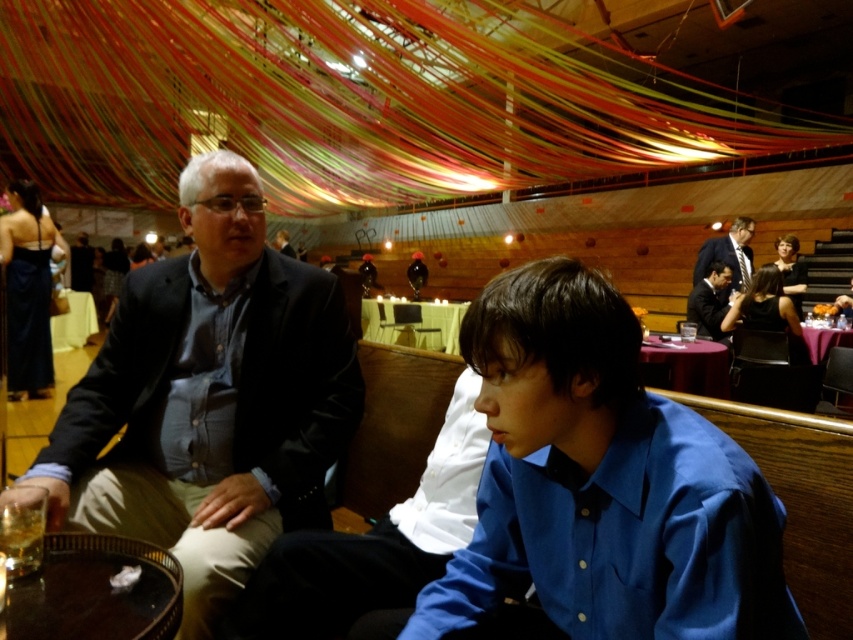
Question: Which point is farther to the camera?

Choices:
 (A) (62, 440)
 (B) (88, 568)
 (C) (815, 339)
 (D) (363, 300)

Answer: (D)

Question: Does dark blue shirt at center have a larger size compared to white cloth at left?

Choices:
 (A) no
 (B) yes

Answer: (B)

Question: Is wooden tray at lower left to the right of matte black suit at upper right from the viewer's perspective?

Choices:
 (A) no
 (B) yes

Answer: (A)

Question: Where is white cloth-covered table at center located in relation to matte black suit at upper right in the image?

Choices:
 (A) right
 (B) left

Answer: (B)

Question: Among these points, which one is nearest to the camera?

Choices:
 (A) (804, 323)
 (B) (373, 340)

Answer: (A)

Question: Which point is farther to the camera?

Choices:
 (A) (183, 493)
 (B) (642, 369)

Answer: (B)